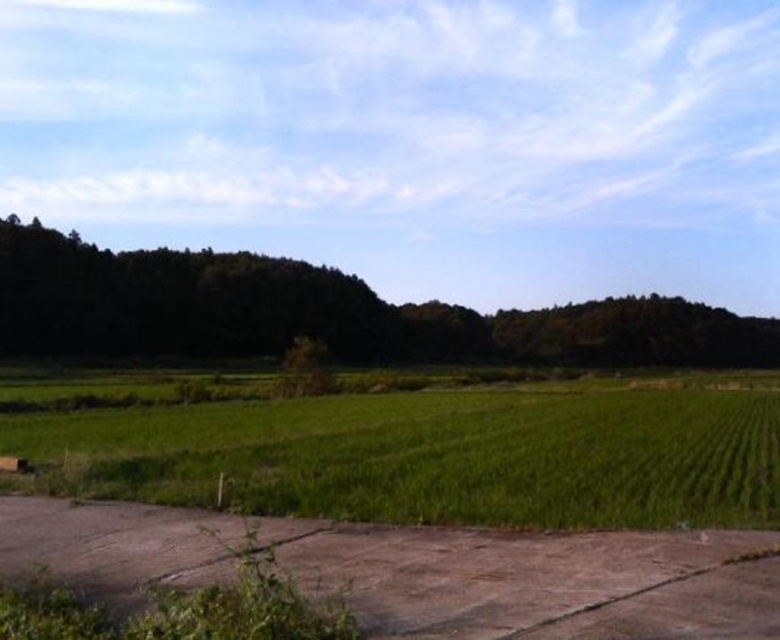
You are standing at the center of the paved area in the foreground. You want to walk to the dense line of trees in the background. Which direction should you walk to avoid the green grass at lower left?

You should walk towards the right side to avoid the green grass at lower left, as it is located at the lower left corner of the scene.

You are standing at the edge of the paved area and want to walk towards the dark green leafy tree at center. However, there is green grass at lower left in your path. Can you walk directly to the tree without stepping on the grass?

The green grass at lower left is in front of the dark green leafy tree at center, so you would have to step on the grass to reach the tree.